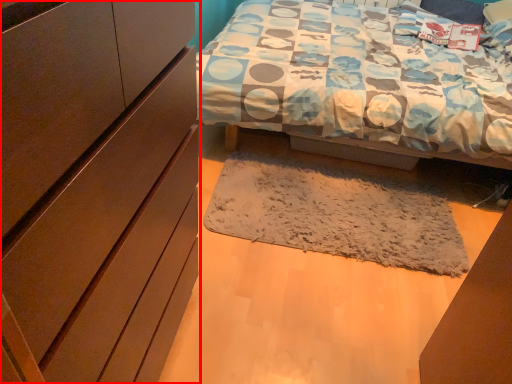
Question: Considering the relative positions of cabinetry (annotated by the red box) and mat in the image provided, where is cabinetry (annotated by the red box) located with respect to the staircase?

Choices:
 (A) left
 (B) right

Answer: (A)